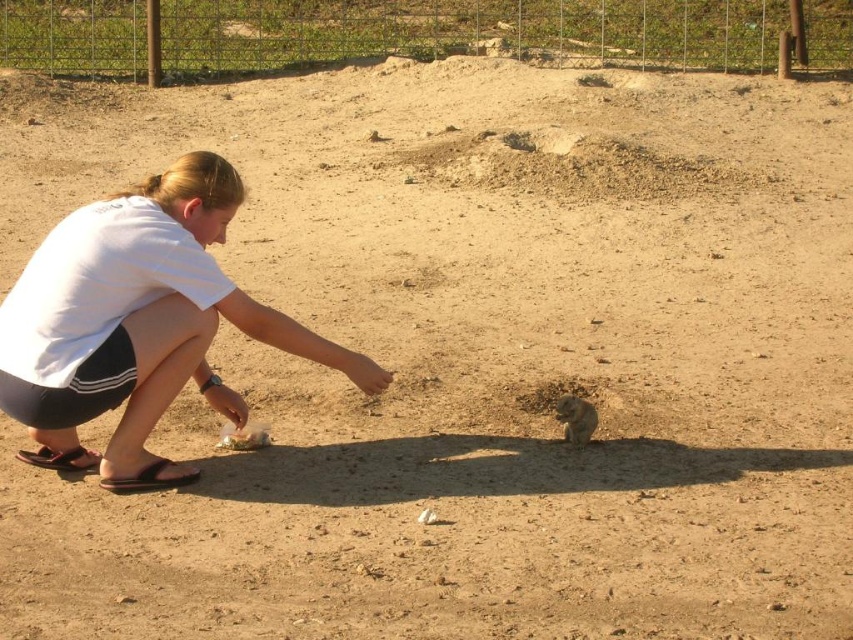
Question: Among these points, which one is farthest from the camera?

Choices:
 (A) (575, 381)
 (B) (589, 412)

Answer: (A)

Question: Which object is farther from the camera taking this photo?

Choices:
 (A) brown dirt hole at center
 (B) fuzzy brown squirrel at lower center

Answer: (A)

Question: Does white matte shirt at center appear on the right side of fuzzy brown squirrel at lower center?

Choices:
 (A) yes
 (B) no

Answer: (B)

Question: Which is nearer to the fuzzy brown squirrel at lower center?

Choices:
 (A) brown dirt hole at center
 (B) white matte shirt at center

Answer: (A)

Question: Is white matte shirt at center thinner than fuzzy brown squirrel at lower center?

Choices:
 (A) no
 (B) yes

Answer: (A)

Question: Is brown dirt hole at center in front of fuzzy brown squirrel at lower center?

Choices:
 (A) yes
 (B) no

Answer: (B)